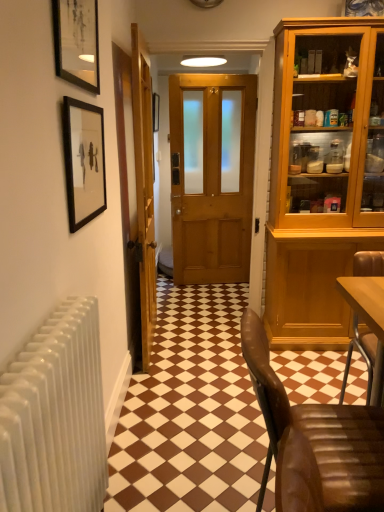
The image size is (384, 512). I want to click on vacant space behind wooden door at center, positioned as the 2th door in left-to-right order, so 206,302.